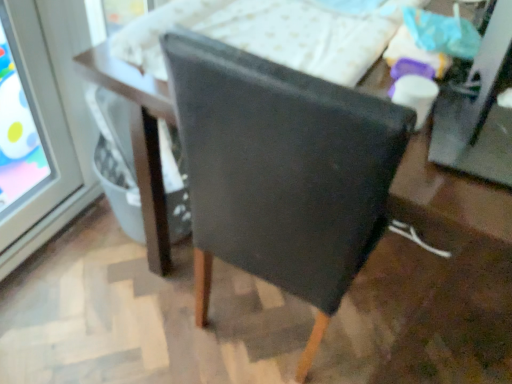
Question: From a real-world perspective, is matte black table at center physically located above or below white textured mattress at upper center?

Choices:
 (A) below
 (B) above

Answer: (A)

Question: From the image's perspective, is matte black table at center above or below white textured mattress at upper center?

Choices:
 (A) above
 (B) below

Answer: (B)

Question: Which object is the closest to the matte black table at center?

Choices:
 (A) white textured mattress at upper center
 (B) matte black chair at center

Answer: (B)

Question: Considering the real-world distances, which object is closest to the white textured mattress at upper center?

Choices:
 (A) matte black chair at center
 (B) matte black table at center

Answer: (B)